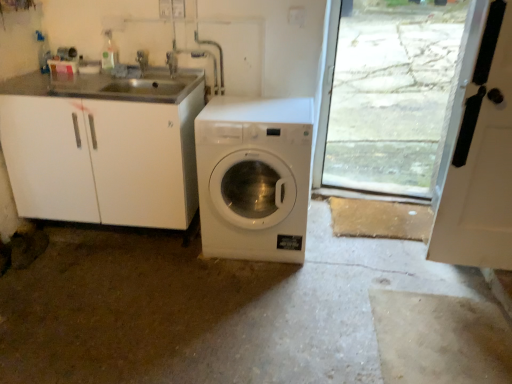
Locate an element on the screen. The height and width of the screenshot is (384, 512). unoccupied area in front of brushed metal faucet at upper center, which is counted as the second faucet, starting from the left is located at coordinates (163, 90).